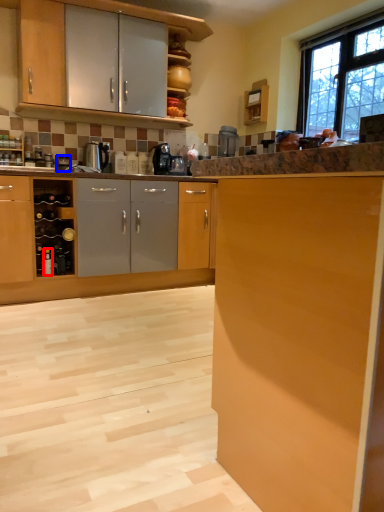
Question: Which of the following is the closest to the observer, bottle (highlighted by a red box) or appliance (highlighted by a blue box)?

Choices:
 (A) bottle
 (B) appliance

Answer: (A)